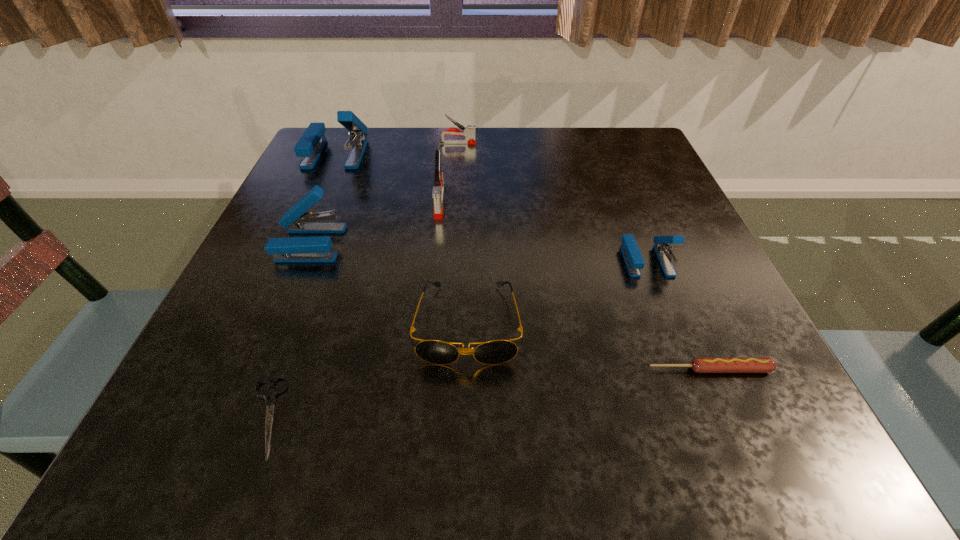
This screenshot has height=540, width=960. What are the coordinates of `brown sausage` in the screenshot? It's located at (699, 364).

Locate an element on the screen. The image size is (960, 540). black shears is located at coordinates (270, 395).

The width and height of the screenshot is (960, 540). I want to click on shears, so click(x=270, y=395).

I want to click on free space located 0.130m on the right of the biggest blue stapler, so click(x=419, y=153).

The width and height of the screenshot is (960, 540). Identify the location of free space located 0.060m on the handle side of the bigger gray stapler. point(436,239).

Locate an element on the screen. The width and height of the screenshot is (960, 540). blank area located 0.100m on the back of the second smallest blue stapler is located at coordinates (329, 196).

Where is `blank space located 0.180m on the handle side of the smaller gray stapler`? The height and width of the screenshot is (540, 960). blank space located 0.180m on the handle side of the smaller gray stapler is located at coordinates (548, 143).

The width and height of the screenshot is (960, 540). In order to click on free space located on the front of the rightmost blue stapler in this screenshot , I will do `click(714, 432)`.

At what (x,y) coordinates should I click in order to perform the action: click on free spot located 0.070m on the lenses of the sunglasses. Please return your answer as a coordinate pair (x, y). The width and height of the screenshot is (960, 540). Looking at the image, I should click on (466, 413).

This screenshot has height=540, width=960. I want to click on free space located 0.060m on the front of the sausage, so click(730, 415).